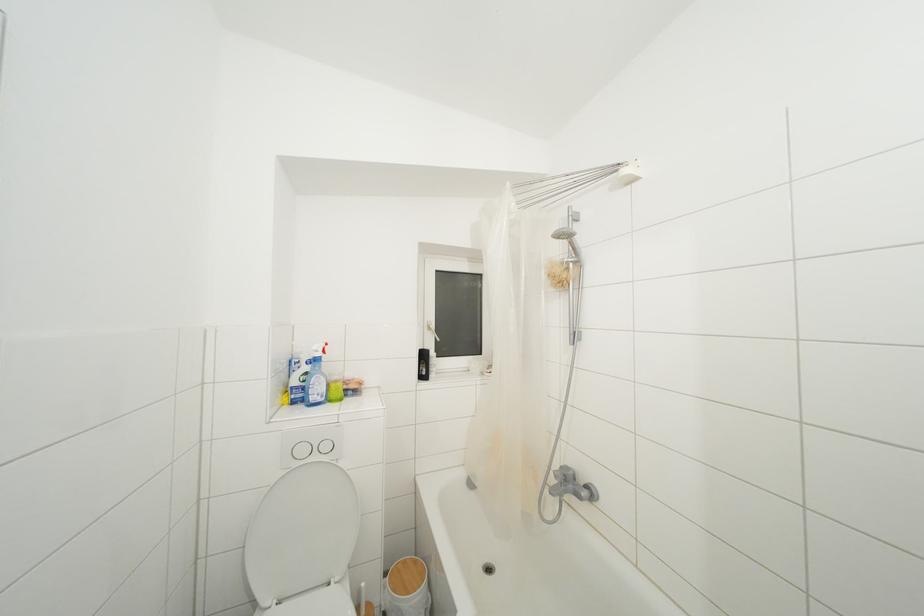
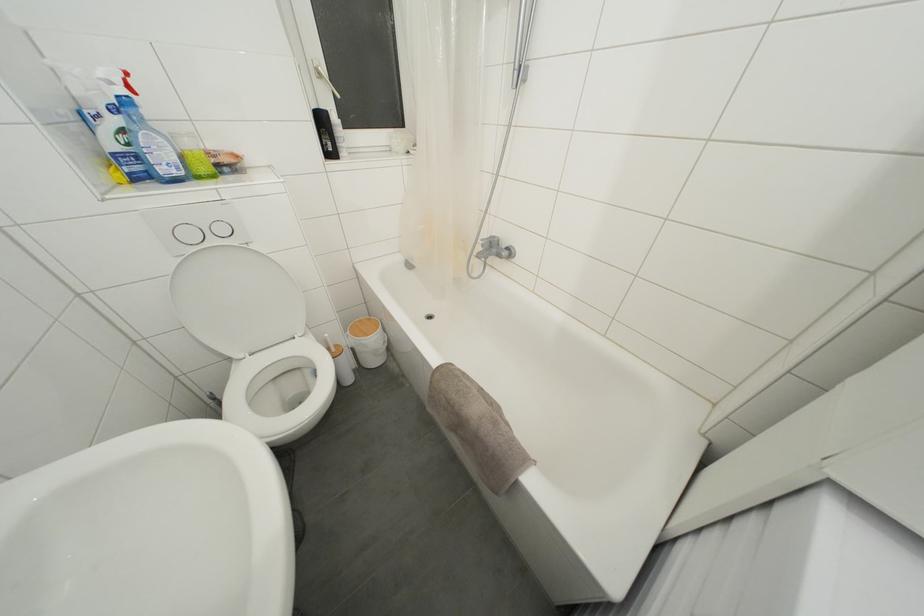
Find the pixel in the second image that matches the point at 307,456 in the first image.

(195, 240)